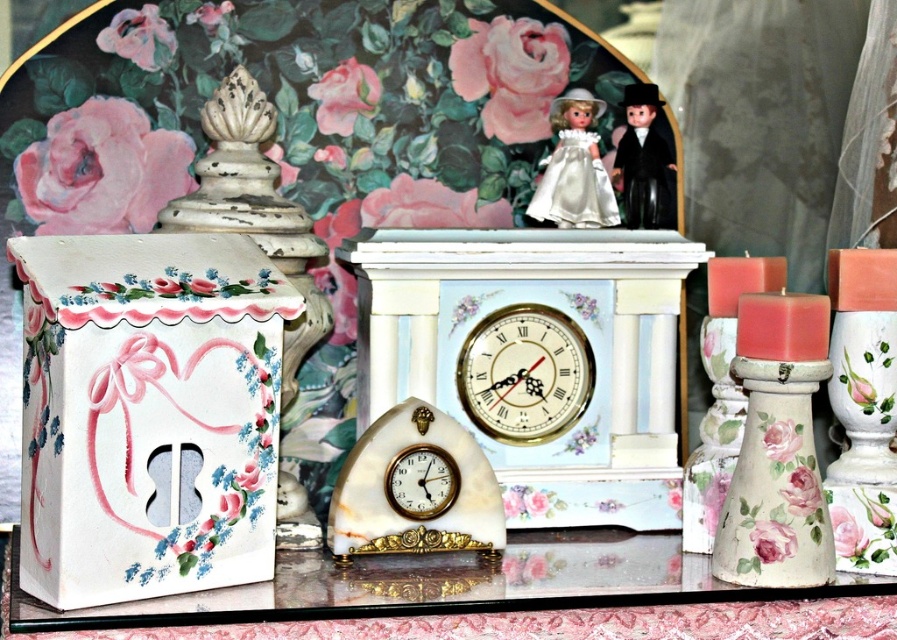
Question: Which point is closer to the camera?

Choices:
 (A) (562, 156)
 (B) (638, 221)

Answer: (A)

Question: Can you confirm if white marble table at center is positioned above white marble clock at center?

Choices:
 (A) yes
 (B) no

Answer: (B)

Question: Is satin white doll at upper center bigger than gold metallic clock at center?

Choices:
 (A) yes
 (B) no

Answer: (A)

Question: Which object is closer to the camera taking this photo?

Choices:
 (A) white marble table at center
 (B) black glossy doll at upper right
 (C) satin white doll at upper center

Answer: (A)

Question: Observing the image, what is the correct spatial positioning of white marble table at center in reference to white marble clock at center?

Choices:
 (A) left
 (B) right

Answer: (A)

Question: Which of these objects is positioned closest to the white marble clock at center?

Choices:
 (A) black glossy doll at upper right
 (B) satin white doll at upper center

Answer: (B)